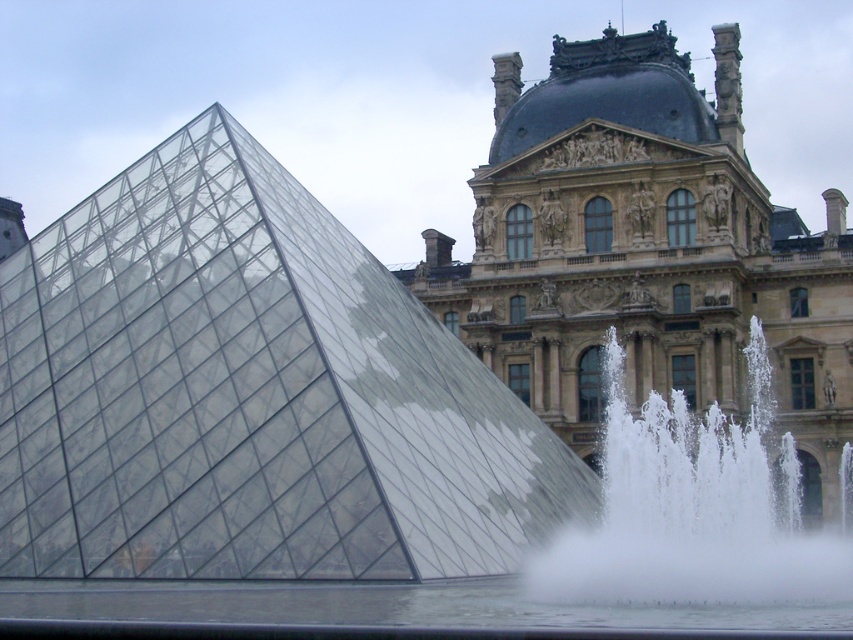
You are an architect evaluating the spatial compatibility of two structures in a design proposal. The transparent glass pyramid at center and the golden stone palace at upper center are part of the plan. Based on their heights, which structure would require a taller foundation to ensure stability?

The golden stone palace at upper center requires a taller foundation since it is taller than the transparent glass pyramid at center.

You are an architect designing a new sculpture that needs to fit between the transparent glass pyramid at center and the golden stone palace at upper center. The sculpture is 1.2 meters wide. Can it fit between them if the space between them is determined by their widths?

The transparent glass pyramid at center is thinner than the golden stone palace at upper center. However, the exact widths are not provided, so we cannot determine if the 1.2 meter sculpture will fit between them based on the given information.

You are a tourist standing at the base of the golden stone palace at upper center. You want to reach the white frothy water at lower right. Which direction should you move relative to the palace?

The golden stone palace at upper center is located above the white frothy water at lower right, so you should move downward from the palace to reach the water.